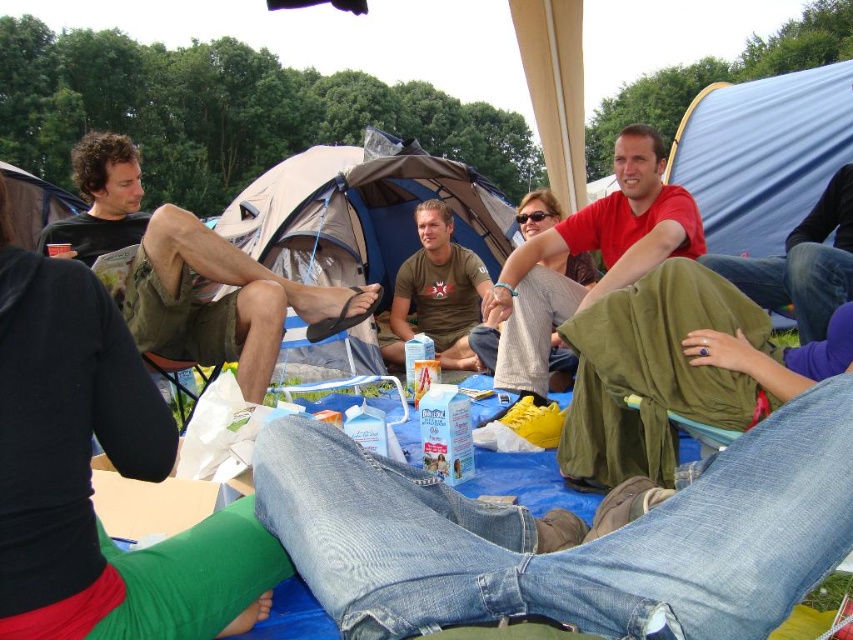
You are standing in the picnic area and want to place a small item on the picnic blanket. You have two points to choose from, point 1 at coordinate point (421, 180) and point 2 at coordinate point (24, 232). Which point is closer to you?

Point 2 at coordinate point (24, 232) is closer to you because it is less further to the camera than point 1 at coordinate point (421, 180).

You are planning to set up a tent for a family of four. You have two options in the image, the blue tarpaulin tent at center and the matte black tent at left. Based on their sizes, which tent would be more suitable for accommodating more people?

The blue tarpaulin tent at center is bigger than the matte black tent at left, so it would be more suitable for accommodating a family of four.